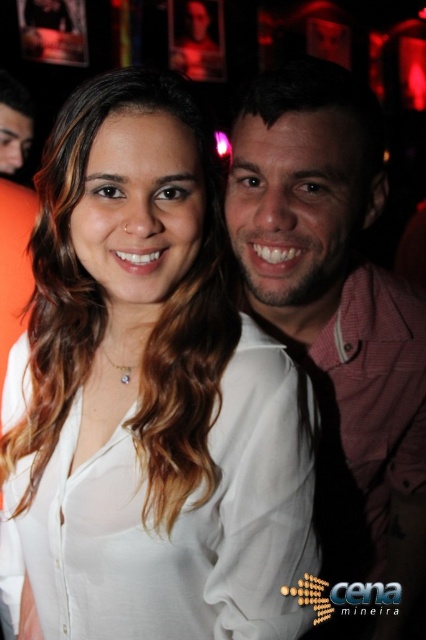
Question: Which point is farther from the camera taking this photo?

Choices:
 (A) (150, 113)
 (B) (362, 211)

Answer: (B)

Question: Among these objects, which one is nearest to the camera?

Choices:
 (A) white silky blouse at center
 (B) matte pink shirt at center

Answer: (A)

Question: Is white silky blouse at center wider than matte pink shirt at center?

Choices:
 (A) no
 (B) yes

Answer: (B)

Question: Which of the following is the closest to the observer?

Choices:
 (A) white silky blouse at center
 (B) matte pink shirt at center

Answer: (A)

Question: Does white silky blouse at center appear on the left side of matte pink shirt at center?

Choices:
 (A) no
 (B) yes

Answer: (B)

Question: Where is white silky blouse at center located in relation to matte pink shirt at center in the image?

Choices:
 (A) above
 (B) below

Answer: (A)